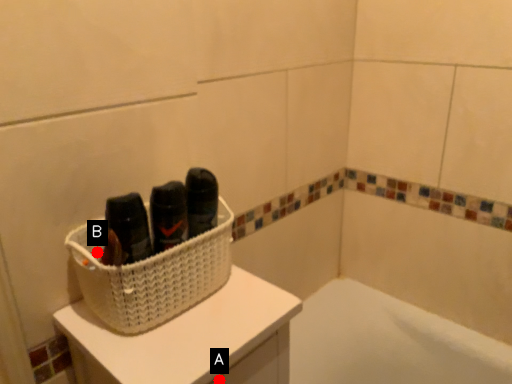
Question: Two points are circled on the image, labeled by A and B beside each circle. Which point is further to the camera?

Choices:
 (A) A is further
 (B) B is further

Answer: (B)